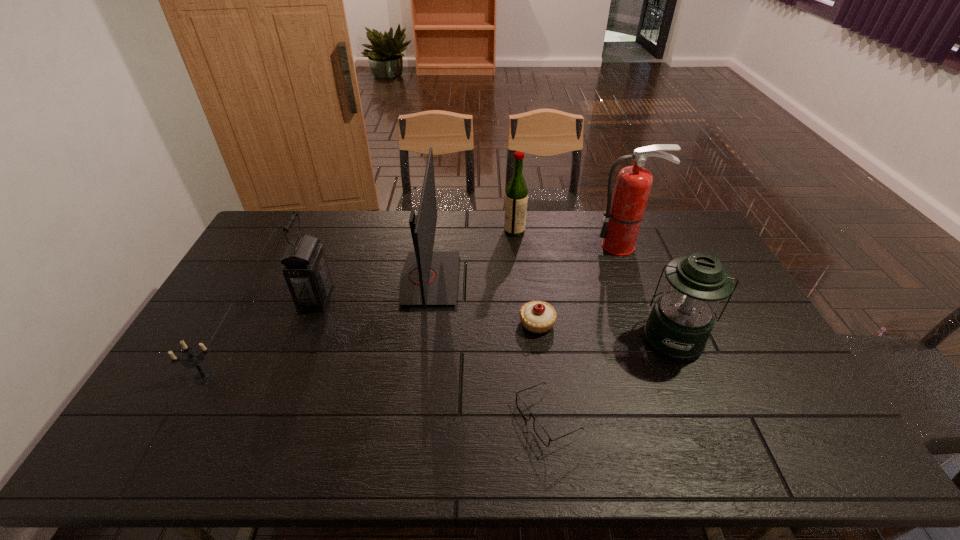
Identify which object is located as the fifth nearest to the liquor. Please provide its 2D coordinates. Your answer should be formatted as a tuple, i.e. [(x, y)], where the tuple contains the x and y coordinates of a point satisfying the conditions above.

[(305, 269)]

This screenshot has width=960, height=540. In order to click on object that is the seventh closest to the liquor in this screenshot , I will do `click(194, 358)`.

The image size is (960, 540). I want to click on free spot that satisfies the following two spatial constraints: 1. on the back side of the pastry; 2. on the front-facing side of the farther lantern, so click(x=534, y=298).

Identify the location of vacant region that satisfies the following two spatial constraints: 1. on the screen side of the third object from left to right; 2. on the front side of the candle holder. This screenshot has height=540, width=960. (417, 377).

The image size is (960, 540). In order to click on free region that satisfies the following two spatial constraints: 1. with the handle and hose on the fire extinguisher; 2. on the front-facing side of the farther lantern in this screenshot , I will do `click(643, 298)`.

Image resolution: width=960 pixels, height=540 pixels. Identify the location of free space in the image that satisfies the following two spatial constraints: 1. on the label of the liquor; 2. on the front side of the sixth tallest object. point(529,377).